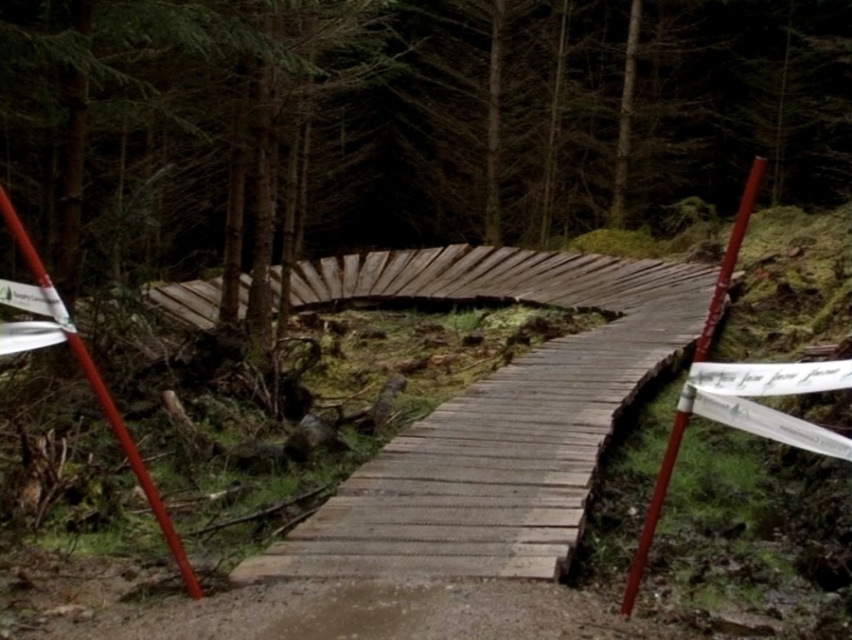
Question: Considering the relative positions of wooden at center and smooth red pole at right in the image provided, where is wooden at center located with respect to smooth red pole at right?

Choices:
 (A) above
 (B) below

Answer: (B)

Question: In this image, where is wooden at center located relative to smooth red pole at right?

Choices:
 (A) below
 (B) above

Answer: (A)

Question: Which point appears closest to the camera in this image?

Choices:
 (A) tap(579, 413)
 (B) tap(124, 426)
 (C) tap(661, 477)

Answer: (C)

Question: Among these objects, which one is nearest to the camera?

Choices:
 (A) wooden at center
 (B) smooth red pole at right

Answer: (B)

Question: Among these points, which one is farthest from the camera?

Choices:
 (A) (32, 298)
 (B) (629, 314)

Answer: (B)

Question: Can you confirm if smooth red pole at left is wider than smooth red pole at right?

Choices:
 (A) yes
 (B) no

Answer: (B)